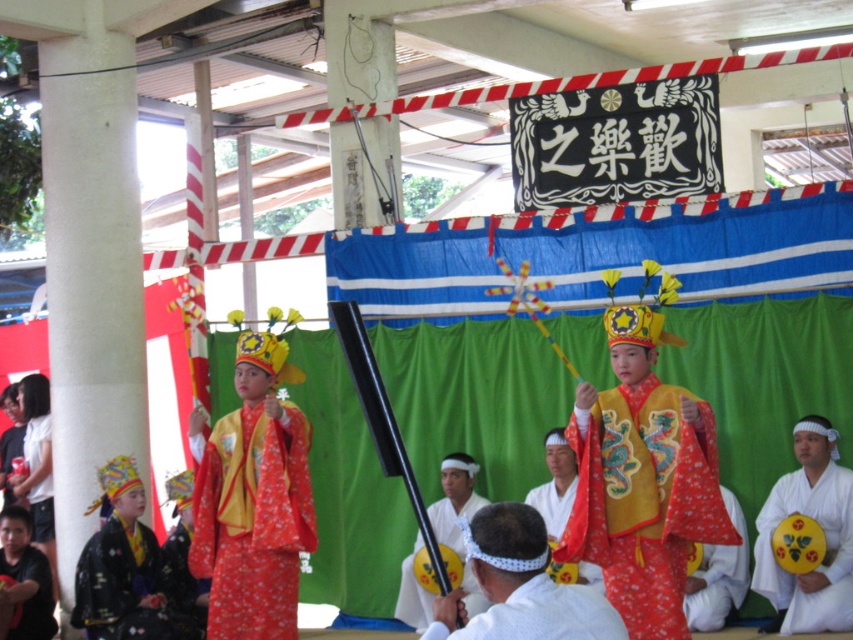
Who is lower down, white fabric at center or black silk kimono at lower left?

black silk kimono at lower left is below.

Can you confirm if white fabric at center is bigger than black silk kimono at lower left?

Yes, white fabric at center is bigger than black silk kimono at lower left.

Locate an element on the screen. This screenshot has width=853, height=640. white fabric at center is located at coordinates (520, 586).

The height and width of the screenshot is (640, 853). I want to click on white fabric at center, so click(x=520, y=586).

This screenshot has height=640, width=853. Describe the element at coordinates (253, 522) in the screenshot. I see `floral silk robe at center` at that location.

Is floral silk robe at center to the right of matte red kimono at left from the viewer's perspective?

Indeed, floral silk robe at center is positioned on the right side of matte red kimono at left.

The height and width of the screenshot is (640, 853). What are the coordinates of `floral silk robe at center` in the screenshot? It's located at (253, 522).

Who is higher up, white matte/soft karate uniform at lower right or smooth black stick at center?

white matte/soft karate uniform at lower right is above.

Based on the photo, does white matte/soft karate uniform at lower right appear on the left side of smooth black stick at center?

Incorrect, white matte/soft karate uniform at lower right is not on the left side of smooth black stick at center.

Locate an element on the screen. This screenshot has height=640, width=853. white matte/soft karate uniform at lower right is located at coordinates (821, 529).

I want to click on white matte/soft karate uniform at lower right, so click(x=821, y=529).